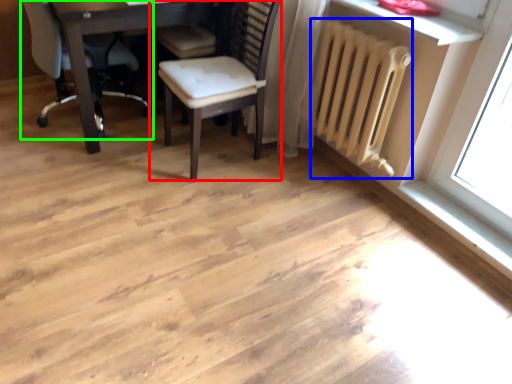
Question: Which is nearer to the chair (highlighted by a red box)? radiator (highlighted by a blue box) or chair (highlighted by a green box).

Choices:
 (A) radiator
 (B) chair

Answer: (A)